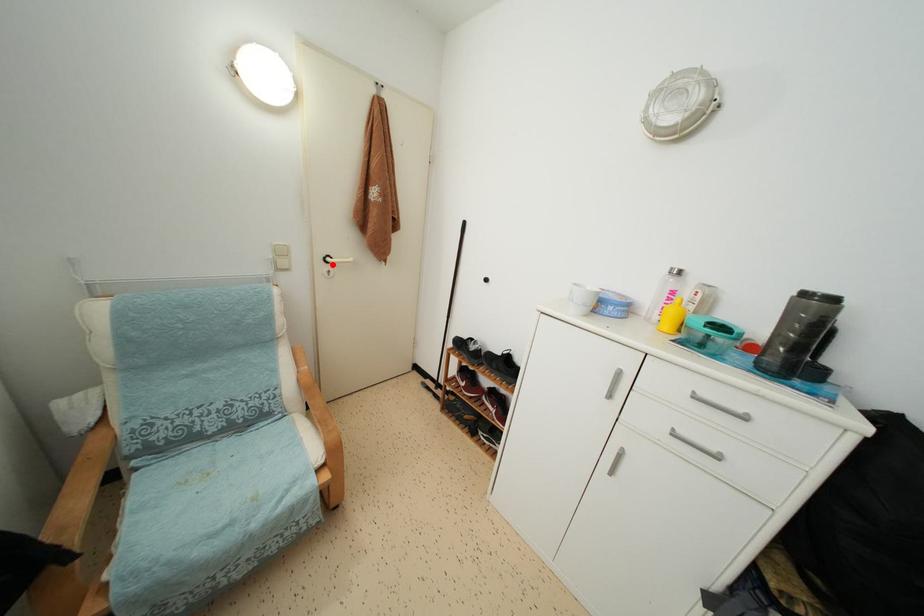
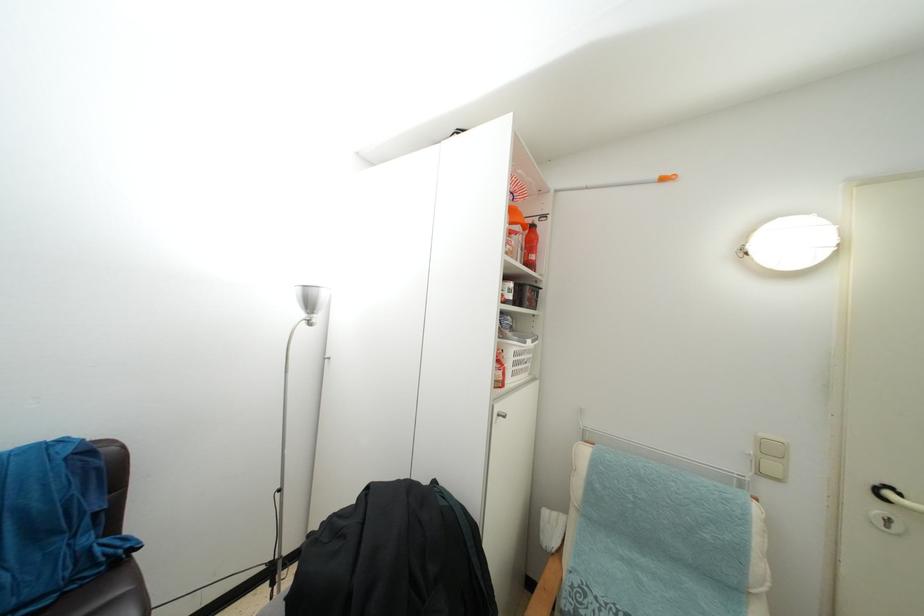
Question: I am providing you with two images of the same scene from different viewpoints. Image1 has a red point marked. In image2, the corresponding 3D location appears at what relative position? Reply with the corresponding letter.

Choices:
 (A) Closer
 (B) Farther

Answer: (A)